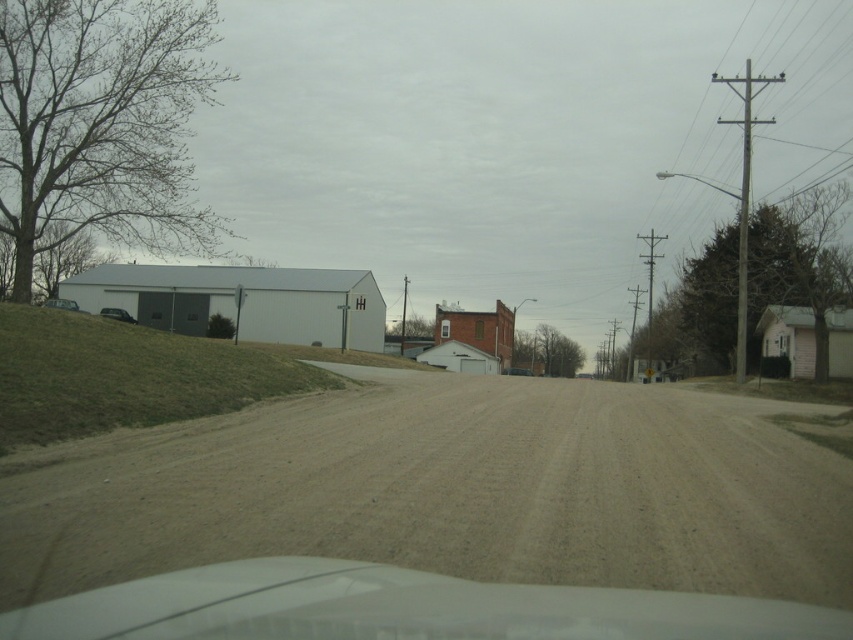
You are driving a vehicle and want to park your matte black car at left on the green grassy hill at left. Based on the scene description, will the car fit on the hill without being blocked by its height?

The green grassy hill at left is taller than the matte black car at left, so the car should fit on the hill without being blocked by its height since the hill is higher than the car.

You are driving a car and want to park behind the matte black car at left and the matte gray car at left. Which one should you park behind to have enough space for your car?

The matte gray car at left is taller than the matte black car at left, so you should park behind the matte gray car at left to have enough space for your car.

You are driving a car and see the matte black car at left and the matte gray car at left parked on the same side of the road. Which car takes up less space from side to side?

The matte black car at left is thinner than the matte gray car at left, so it takes up less space from side to side.